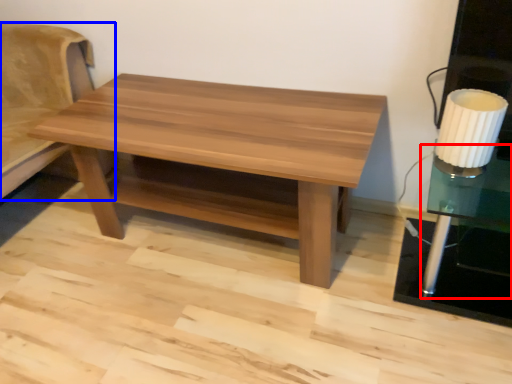
Question: Which of the following is the closest to the observer, side table (highlighted by a red box) or futon (highlighted by a blue box)?

Choices:
 (A) side table
 (B) futon

Answer: (A)